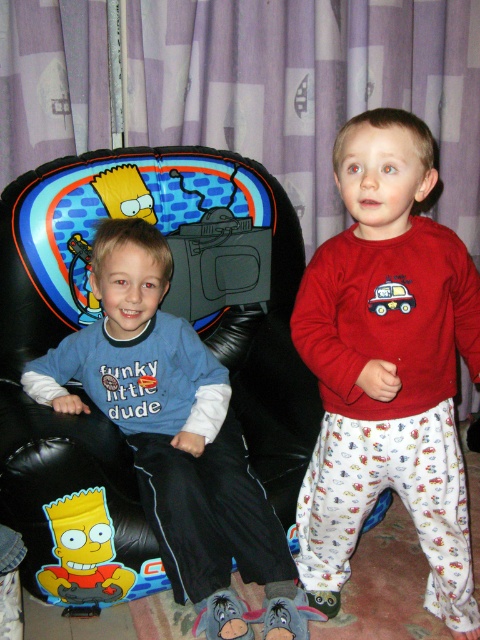
Between point (369, 492) and point (80, 513), which one is positioned in front?

Positioned in front is point (80, 513).

Does point (330, 570) lie in front of point (109, 541)?

No.

The height and width of the screenshot is (640, 480). What do you see at coordinates (387, 369) in the screenshot? I see `red cotton pajamas at right` at bounding box center [387, 369].

What are the coordinates of `red cotton pajamas at right` in the screenshot? It's located at (387, 369).

Based on the photo, is yellow matte bart simpson at left below matte plastic car at right?

Correct, yellow matte bart simpson at left is located below matte plastic car at right.

Can you confirm if yellow matte bart simpson at left is taller than matte plastic car at right?

Yes.

Consider the image. Who is more forward, (61, 570) or (383, 296)?

Point (383, 296)

Locate an element on the screen. The width and height of the screenshot is (480, 640). yellow matte bart simpson at left is located at coordinates (83, 552).

Does matte blue shirt at center have a lesser width compared to yellow matte bart simpson at left?

No.

Who is more distant from viewer, (x=135, y=337) or (x=80, y=522)?

Positioned behind is point (x=135, y=337).

What are the coordinates of `matte blue shirt at center` in the screenshot? It's located at coord(176,436).